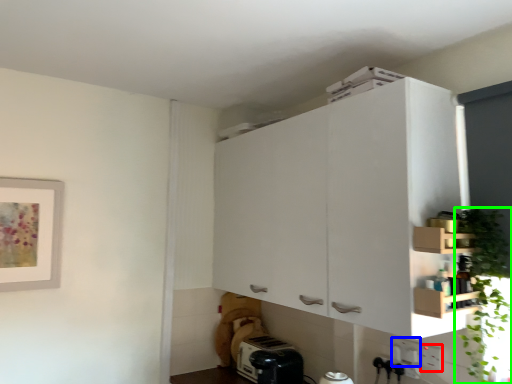
Question: Considering the real-world distances, which object is farthest from electric outlet (highlighted by a red box)? electric outlet (highlighted by a blue box) or plant (highlighted by a green box)?

Choices:
 (A) electric outlet
 (B) plant

Answer: (B)